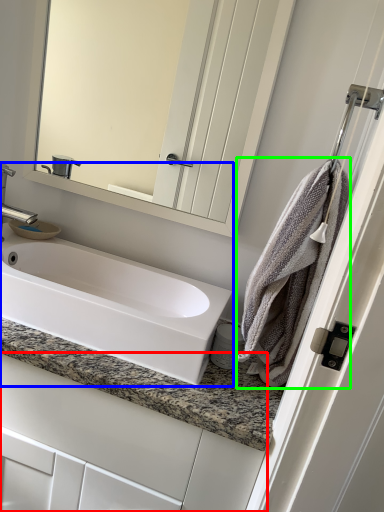
Question: Estimate the real-world distances between objects in this image. Which object is closer to bathroom cabinet (highlighted by a red box), sink (highlighted by a blue box) or bath towel (highlighted by a green box)?

Choices:
 (A) sink
 (B) bath towel

Answer: (A)